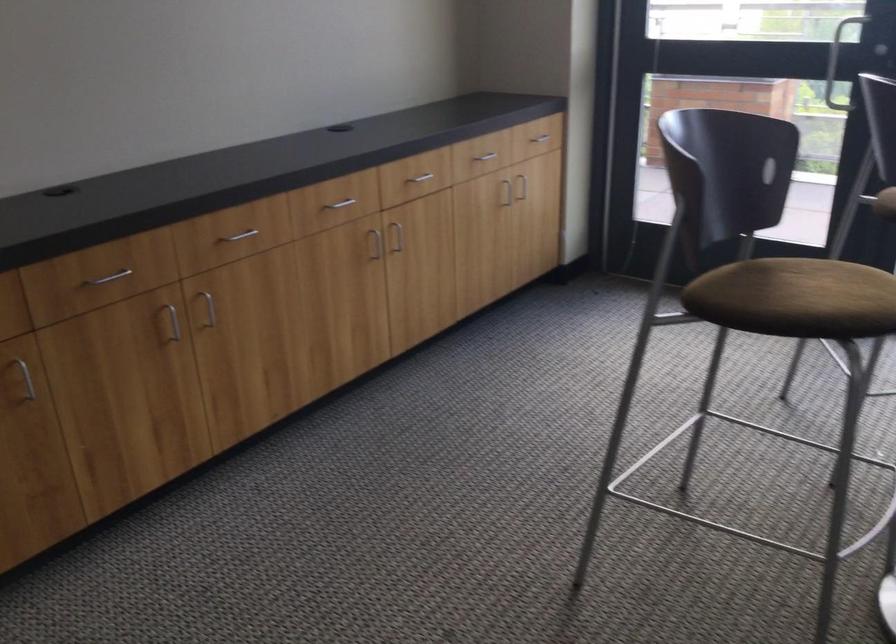
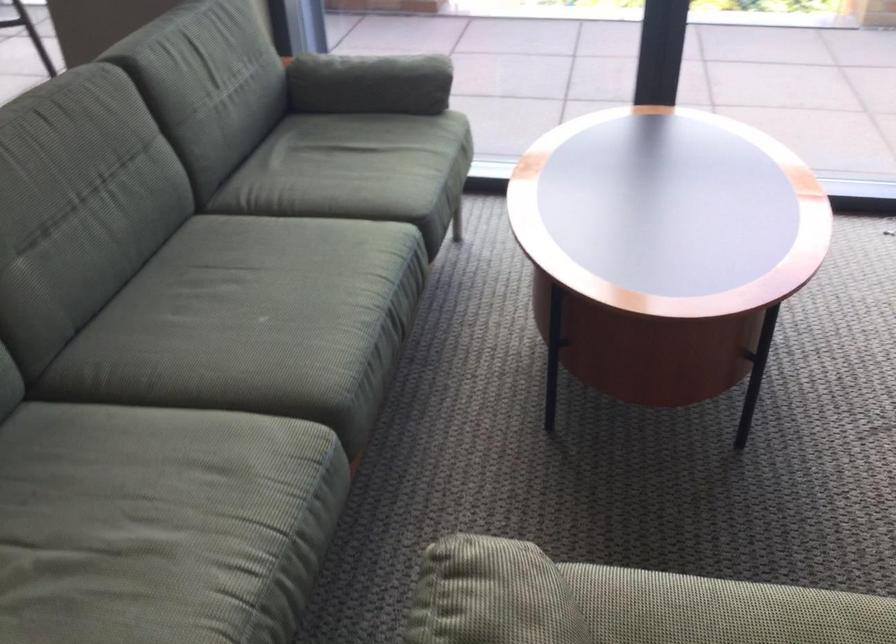
Question: The images are taken continuously from a first-person perspective. In which direction are you moving?

Choices:
 (A) Left
 (B) Right
 (C) Forward
 (D) Backward

Answer: (B)